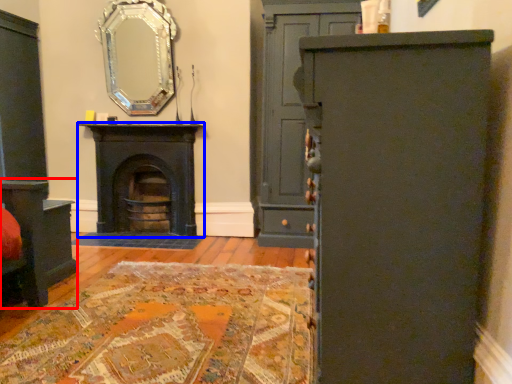
Question: Which of the following is the farthest to the observer, vanity (highlighted by a red box) or fireplace (highlighted by a blue box)?

Choices:
 (A) vanity
 (B) fireplace

Answer: (B)